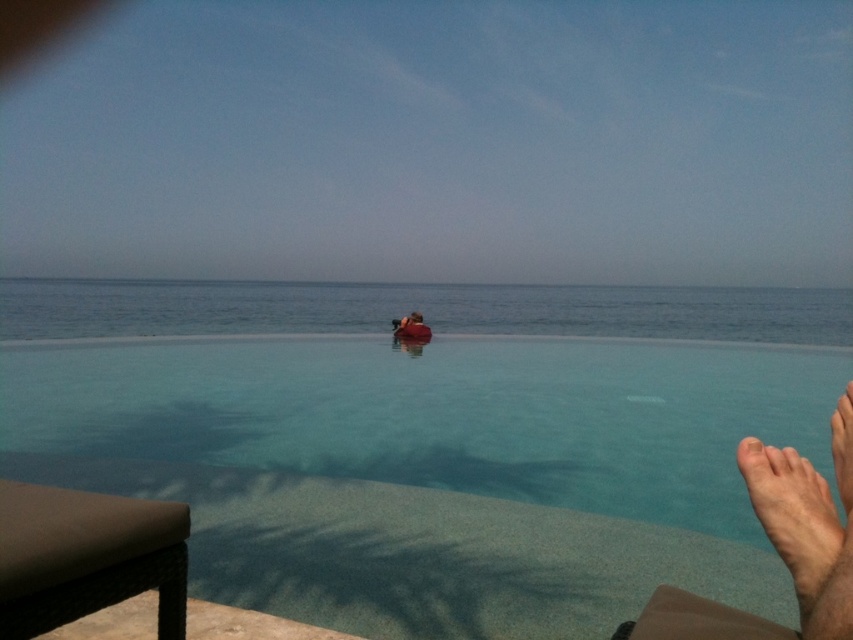
You are a photographer standing at the edge of the pool. You want to take a photo of the dark brown leather chair at center and the skinny barefoot at lower right. Which object should you position to your left to include both in the frame?

To include both the dark brown leather chair at center and the skinny barefoot at lower right in the frame, position the dark brown leather chair at center to your left since the skinny barefoot at lower right is to the right of it.

You are planning to place a new decorative item on the poolside area. The clear blue water at center and the dark brown leather chair at center are already present. Which of these two objects takes up more space in the image?

The clear blue water at center is larger in size than the dark brown leather chair at center, so it occupies more space in the image.

Looking at this image, you are a photographer trying to capture the poolside scene. You need to place a 1.2 meter wide camera tripod between the skinny barefoot at lower right and the dark brown leather chair at center. Can the tripod fit between them without overlapping either object?

The skinny barefoot at lower right is narrower than the dark brown leather chair at center. However, the exact distance between them isn t specified in the provided description. Without knowing the space between the two objects, it s impossible to determine if the tripod will fit.